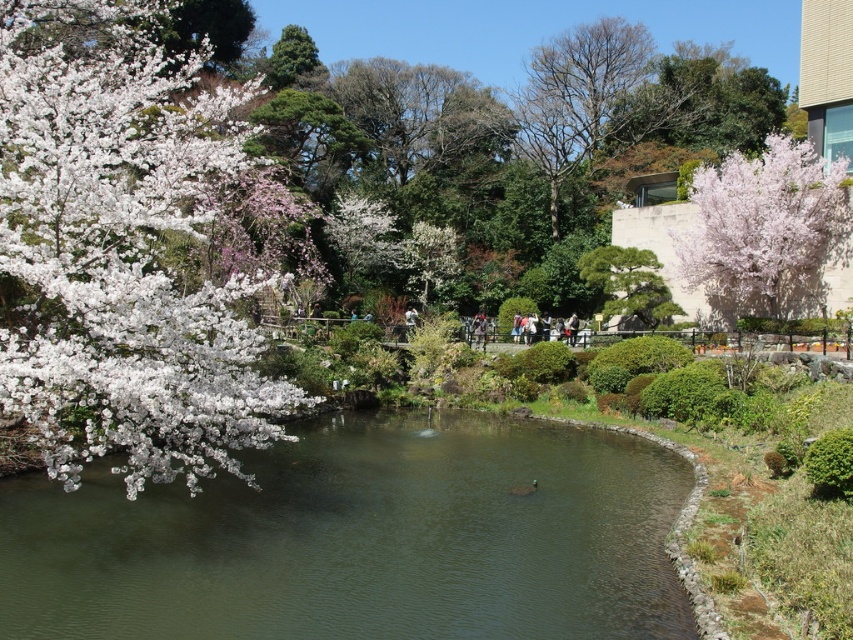
Question: Which object is farther from the camera taking this photo?

Choices:
 (A) green textured bonsai tree at center
 (B) green smooth water at center

Answer: (A)

Question: Which point is farther to the camera?

Choices:
 (A) slightly glossy pink blossoms at upper right
 (B) green textured bonsai tree at center
 (C) green smooth water at center

Answer: (B)

Question: Is white matte blossoms at left to the left of slightly glossy pink blossoms at upper right from the viewer's perspective?

Choices:
 (A) no
 (B) yes

Answer: (B)

Question: Observing the image, what is the correct spatial positioning of green smooth water at center in reference to white matte blossoms at left?

Choices:
 (A) left
 (B) right

Answer: (B)

Question: Which object is positioned closest to the green textured bonsai tree at center?

Choices:
 (A) white matte blossoms at left
 (B) green smooth water at center

Answer: (B)

Question: Can you confirm if green smooth water at center is smaller than white matte blossoms at left?

Choices:
 (A) no
 (B) yes

Answer: (B)